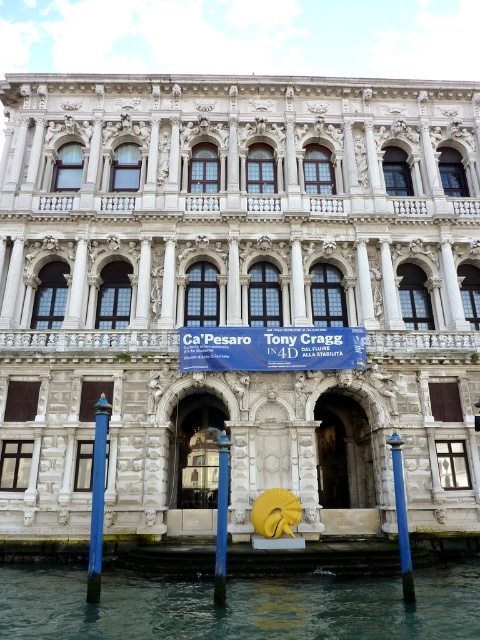
Question: Which object appears closest to the camera in this image?

Choices:
 (A) blue painted wood post at lower left
 (B) white stone building at center
 (C) blue glossy pole at center

Answer: (A)

Question: Estimate the real-world distances between objects in this image. Which object is farther from the clear water at lower center?

Choices:
 (A) blue painted metal pole at lower right
 (B) blue fabric sign at center
 (C) white stone building at center
 (D) blue painted wood post at lower left

Answer: (C)

Question: Does blue glossy pole at center appear over blue painted metal pole at lower right?

Choices:
 (A) no
 (B) yes

Answer: (A)

Question: Can you confirm if clear water at lower center is positioned above blue painted wood post at lower left?

Choices:
 (A) no
 (B) yes

Answer: (A)

Question: Does white stone building at center appear on the right side of blue painted metal pole at lower right?

Choices:
 (A) no
 (B) yes

Answer: (A)

Question: Which point is closer to the camera?

Choices:
 (A) (284, 618)
 (B) (98, 524)

Answer: (A)